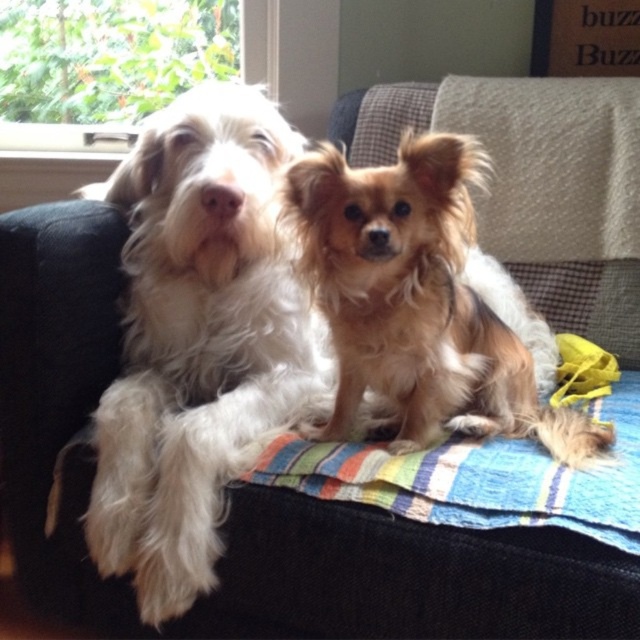
Question: Considering the relative positions of white fluffy dog at left and striped cotton blanket at center in the image provided, where is white fluffy dog at left located with respect to striped cotton blanket at center?

Choices:
 (A) right
 (B) left

Answer: (B)

Question: Can you confirm if white fluffy dog at left is thinner than striped cotton blanket at center?

Choices:
 (A) no
 (B) yes

Answer: (B)

Question: Which object appears closest to the camera in this image?

Choices:
 (A) striped cotton blanket at center
 (B) white fluffy dog at left

Answer: (A)

Question: Which of the following is the closest to the observer?

Choices:
 (A) (408, 307)
 (B) (380, 467)

Answer: (B)

Question: Which object appears closest to the camera in this image?

Choices:
 (A) golden fur dog at center
 (B) striped cotton blanket at center

Answer: (B)

Question: Is white fluffy dog at left further to the viewer compared to striped cotton blanket at center?

Choices:
 (A) no
 (B) yes

Answer: (B)